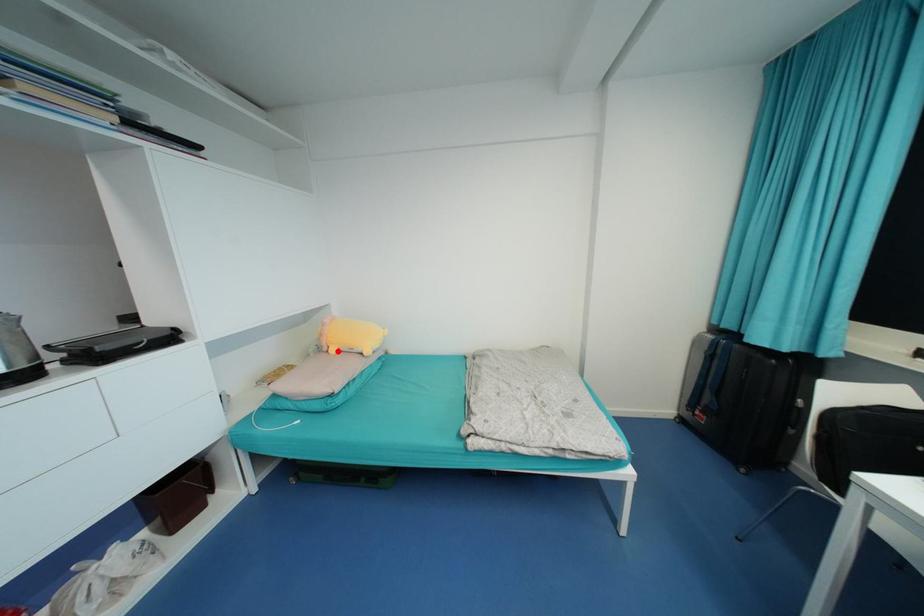
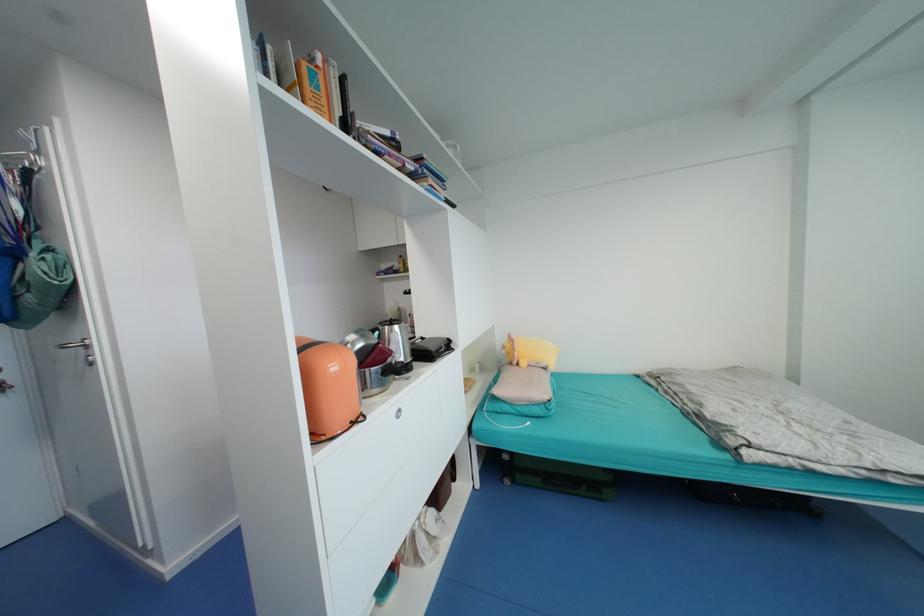
In the second image, find the point that corresponds to the highlighted location in the first image.

(529, 365)